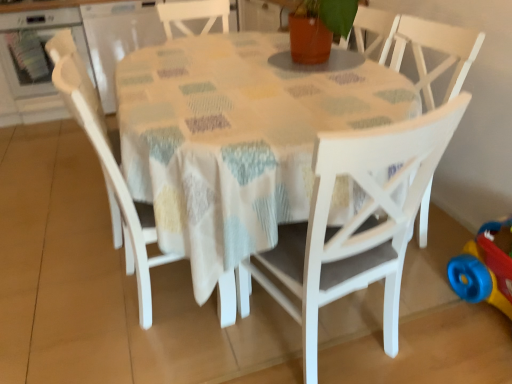
Question: From a real-world perspective, is transparent plastic container at upper left physically above matte white chair at left, the 1th chair positioned from the left?

Choices:
 (A) no
 (B) yes

Answer: (B)

Question: From the image's perspective, is transparent plastic container at upper left located beneath matte white chair at left, the 1th chair positioned from the left?

Choices:
 (A) no
 (B) yes

Answer: (A)

Question: From the image's perspective, is transparent plastic container at upper left above matte white chair at left, the third chair in the right-to-left sequence?

Choices:
 (A) yes
 (B) no

Answer: (A)

Question: Considering the relative sizes of transparent plastic container at upper left and matte white chair at left, the third chair in the right-to-left sequence, in the image provided, is transparent plastic container at upper left wider than matte white chair at left, the third chair in the right-to-left sequence,?

Choices:
 (A) yes
 (B) no

Answer: (A)

Question: Does transparent plastic container at upper left come in front of matte white chair at left, the third chair in the right-to-left sequence?

Choices:
 (A) yes
 (B) no

Answer: (B)

Question: Does point (314, 246) appear closer or farther from the camera than point (77, 79)?

Choices:
 (A) farther
 (B) closer

Answer: (B)

Question: Looking at their shapes, would you say white matte chair at center, the 3th chair positioned from the left, is wider or thinner than matte white chair at left, the third chair in the right-to-left sequence?

Choices:
 (A) thin
 (B) wide

Answer: (B)

Question: Considering the positions of white matte chair at center, placed as the 1th chair when sorted from right to left, and matte white chair at left, the third chair in the right-to-left sequence, in the image, is white matte chair at center, placed as the 1th chair when sorted from right to left, taller or shorter than matte white chair at left, the third chair in the right-to-left sequence,?

Choices:
 (A) short
 (B) tall

Answer: (B)

Question: From a real-world perspective, is white matte chair at center, placed as the 1th chair when sorted from right to left, positioned above or below matte white chair at left, the third chair in the right-to-left sequence?

Choices:
 (A) above
 (B) below

Answer: (B)

Question: From the image's perspective, relative to matte white chair at left, the third chair in the right-to-left sequence, is transparent plastic container at upper left above or below?

Choices:
 (A) below
 (B) above

Answer: (B)

Question: Relative to matte white chair at left, the 1th chair positioned from the left, is transparent plastic container at upper left in front or behind?

Choices:
 (A) behind
 (B) front

Answer: (A)

Question: Looking at their shapes, would you say transparent plastic container at upper left is wider or thinner than matte white chair at left, the 1th chair positioned from the left?

Choices:
 (A) thin
 (B) wide

Answer: (B)

Question: Do you think transparent plastic container at upper left is within matte white chair at left, the 1th chair positioned from the left, or outside of it?

Choices:
 (A) outside
 (B) inside

Answer: (A)

Question: From their relative heights in the image, would you say white matte chair at center, the 3th chair positioned from the left, is taller or shorter than white wood table at center?

Choices:
 (A) short
 (B) tall

Answer: (B)

Question: In terms of width, does white matte chair at center, placed as the 1th chair when sorted from right to left, look wider or thinner when compared to white wood table at center?

Choices:
 (A) wide
 (B) thin

Answer: (B)